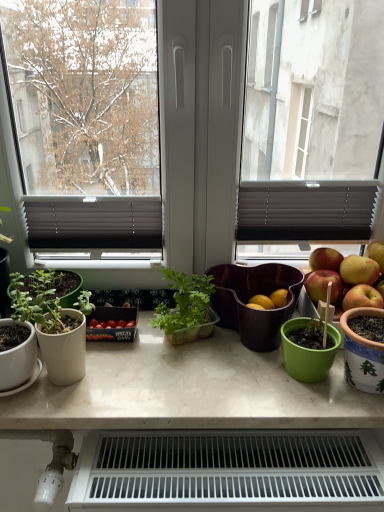
Where is `free space in front of matte purple salad bowl at center`? The height and width of the screenshot is (512, 384). free space in front of matte purple salad bowl at center is located at coordinates (244, 392).